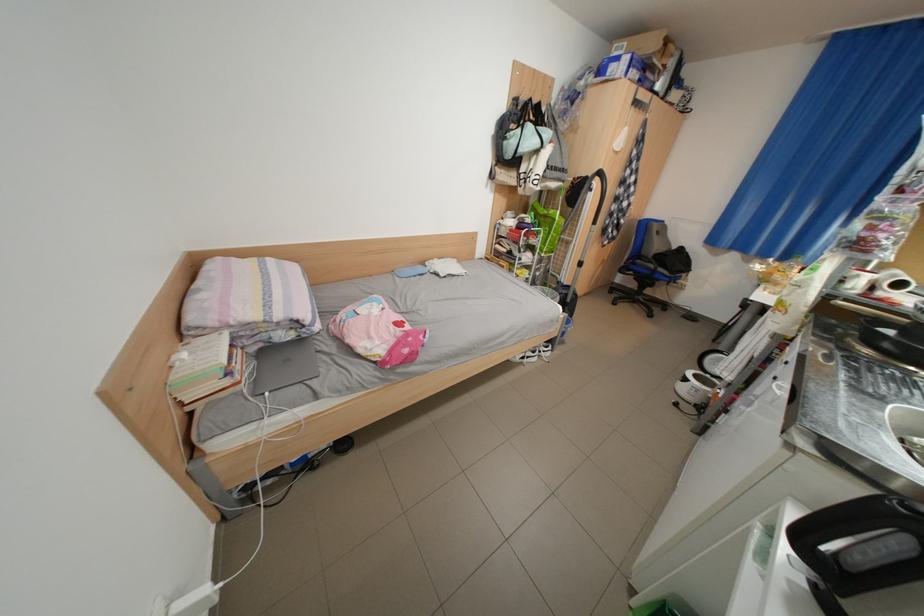
Where would you lift the black frying pan? Please return your answer as a coordinate pair (x, y).

(892, 336)